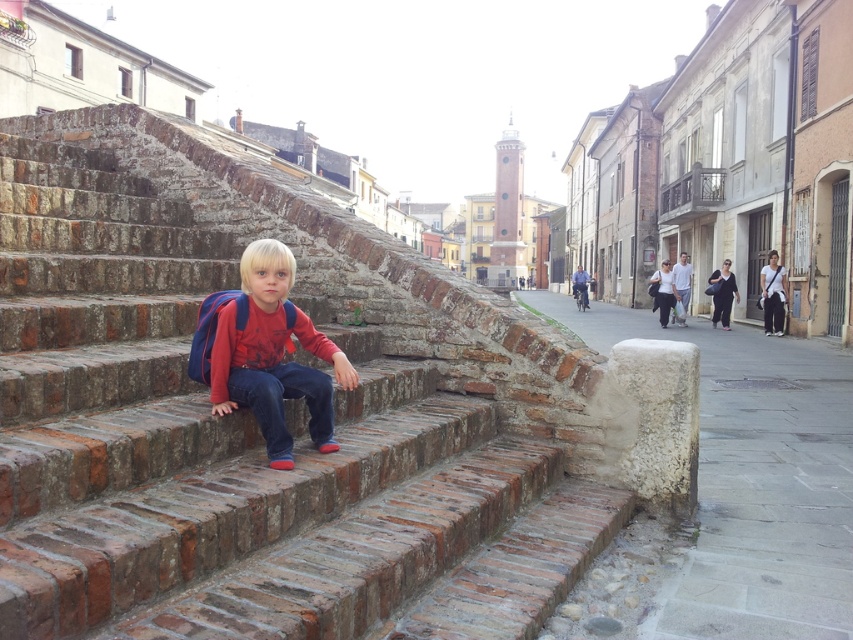
Question: Which of the following is the farthest from the observer?

Choices:
 (A) (329, 436)
 (B) (102, 362)

Answer: (A)

Question: Is the position of brick stairs at center less distant than that of matte red shirt at center?

Choices:
 (A) no
 (B) yes

Answer: (B)

Question: Which of the following is the closest to the observer?

Choices:
 (A) (515, 556)
 (B) (250, 276)

Answer: (A)

Question: Among these points, which one is nearest to the camera?

Choices:
 (A) (115, 390)
 (B) (281, 452)

Answer: (B)

Question: Does brick stairs at center appear over matte red shirt at center?

Choices:
 (A) no
 (B) yes

Answer: (A)

Question: Is brick stairs at center thinner than matte red shirt at center?

Choices:
 (A) no
 (B) yes

Answer: (B)